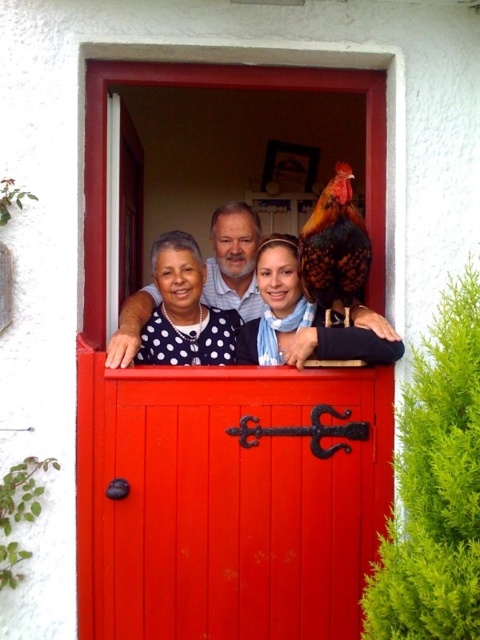
Question: Does smooth glossy wood door at center appear over polka dot blouse at center?

Choices:
 (A) no
 (B) yes

Answer: (A)

Question: Which object appears closest to the camera in this image?

Choices:
 (A) polka dot blouse at center
 (B) smooth glossy wood door at center
 (C) matte black scarf at center
 (D) white dotted dress at center

Answer: (B)

Question: Which point is farther from the camera taking this photo?

Choices:
 (A) (153, 273)
 (B) (129, 310)
 (C) (326, 572)

Answer: (A)

Question: Among these objects, which one is nearest to the camera?

Choices:
 (A) white dotted dress at center
 (B) smooth glossy wood door at center

Answer: (B)

Question: Observing the image, what is the correct spatial positioning of matte black scarf at center in reference to polka dot blouse at center?

Choices:
 (A) below
 (B) above

Answer: (A)

Question: In this image, where is smooth glossy wood door at center located relative to polka dot blouse at center?

Choices:
 (A) above
 (B) below

Answer: (B)